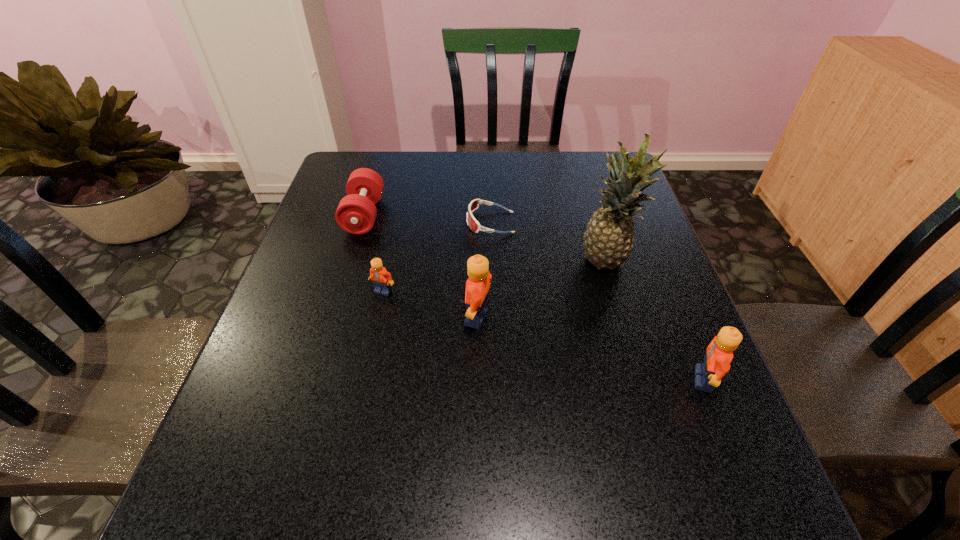
Choose which object is the nearest neighbor to the tallest object. Please provide its 2D coordinates. Your answer should be formatted as a tuple, i.e. [(x, y)], where the tuple contains the x and y coordinates of a point satisfying the conditions above.

[(474, 225)]

Where is `the closest Lego to the farthest Lego`? the closest Lego to the farthest Lego is located at coordinates [478, 284].

Locate an element on the screen. The width and height of the screenshot is (960, 540). Lego that stands as the closest to the second tallest Lego is located at coordinates (478, 284).

Where is `vacant space that satisfies the following two spatial constraints: 1. on the front-facing side of the fifth object from left to right; 2. on the left side of the shortest object`? vacant space that satisfies the following two spatial constraints: 1. on the front-facing side of the fifth object from left to right; 2. on the left side of the shortest object is located at coordinates (492, 261).